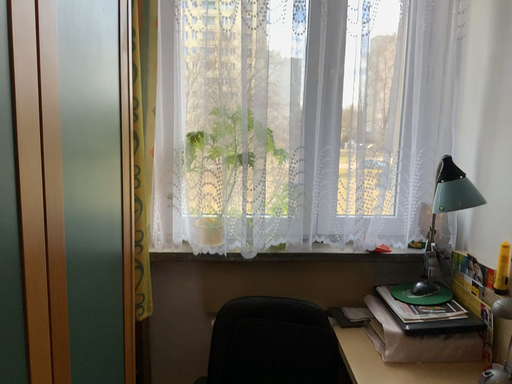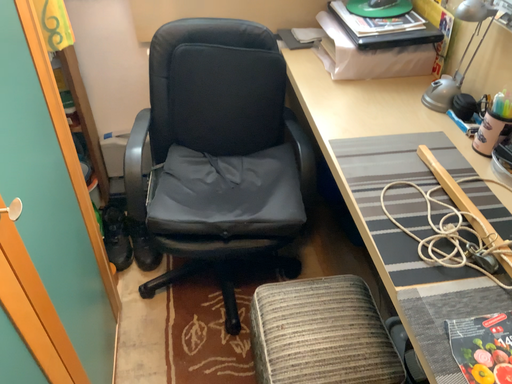
Question: How did the camera likely rotate when shooting the video?

Choices:
 (A) rotated downward
 (B) rotated upward

Answer: (A)